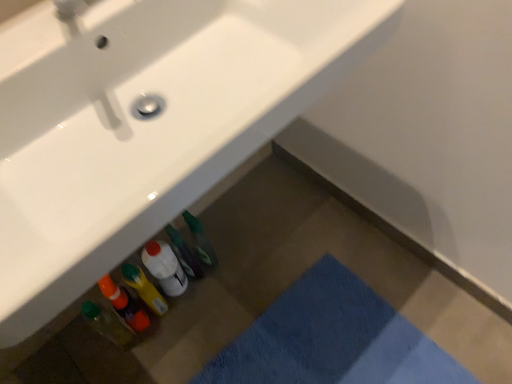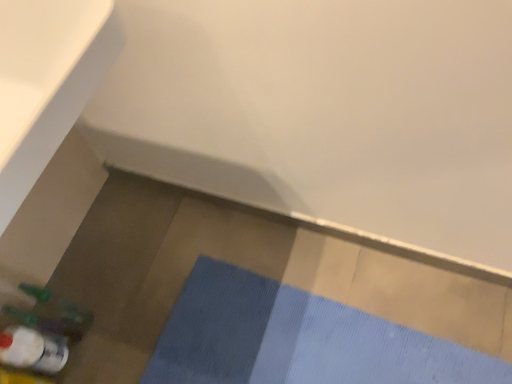
Question: Which way did the camera rotate in the video?

Choices:
 (A) rotated right
 (B) rotated left

Answer: (A)